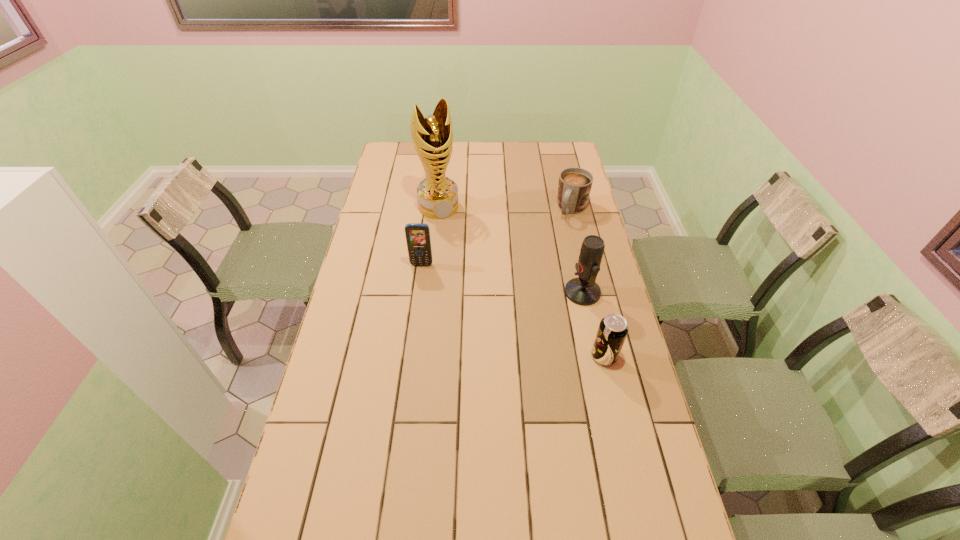
Where is `vacant space on the desktop that is between the cellular telephone and the nearest object and is positioned on the side of the fourth farthest object with the red ring`? The height and width of the screenshot is (540, 960). vacant space on the desktop that is between the cellular telephone and the nearest object and is positioned on the side of the fourth farthest object with the red ring is located at coordinates (510, 309).

Where is `vacant space on the desktop that is between the cellular telephone and the nearest object and is positioned on the front-facing side of the award`? Image resolution: width=960 pixels, height=540 pixels. vacant space on the desktop that is between the cellular telephone and the nearest object and is positioned on the front-facing side of the award is located at coordinates (480, 294).

The image size is (960, 540). I want to click on vacant space on the desktop that is between the third nearest object and the nearest object and is positioned on the side of the mug with the handle, so click(x=514, y=311).